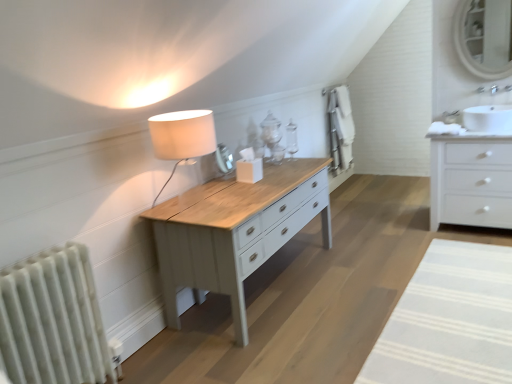
Question: Considering the relative positions of white striped rug at lower right and matte white mirror at upper right in the image provided, is white striped rug at lower right to the right of matte white mirror at upper right from the viewer's perspective?

Choices:
 (A) no
 (B) yes

Answer: (A)

Question: Can you confirm if white striped rug at lower right is positioned to the left of matte white mirror at upper right?

Choices:
 (A) yes
 (B) no

Answer: (A)

Question: From the image's perspective, is white striped rug at lower right on matte white mirror at upper right?

Choices:
 (A) yes
 (B) no

Answer: (B)

Question: Is white striped rug at lower right completely or partially outside of matte white mirror at upper right?

Choices:
 (A) no
 (B) yes

Answer: (B)

Question: Is there a large distance between white striped rug at lower right and matte white mirror at upper right?

Choices:
 (A) yes
 (B) no

Answer: (A)

Question: Is white striped rug at lower right wider than matte white mirror at upper right?

Choices:
 (A) yes
 (B) no

Answer: (A)

Question: Are white glossy chest of drawers at right and white textured radiator at left far apart?

Choices:
 (A) no
 (B) yes

Answer: (B)

Question: Is white glossy chest of drawers at right completely or partially outside of white textured radiator at left?

Choices:
 (A) yes
 (B) no

Answer: (A)

Question: Is white glossy chest of drawers at right shorter than white textured radiator at left?

Choices:
 (A) no
 (B) yes

Answer: (A)

Question: Is white glossy chest of drawers at right thinner than white textured radiator at left?

Choices:
 (A) no
 (B) yes

Answer: (A)

Question: Would you say white textured radiator at left is part of white glossy chest of drawers at right's contents?

Choices:
 (A) yes
 (B) no

Answer: (B)

Question: From the image's perspective, is white glossy chest of drawers at right under white textured radiator at left?

Choices:
 (A) no
 (B) yes

Answer: (A)

Question: From a real-world perspective, is matte white mirror at upper right physically below white glossy chest of drawers at right?

Choices:
 (A) no
 (B) yes

Answer: (A)